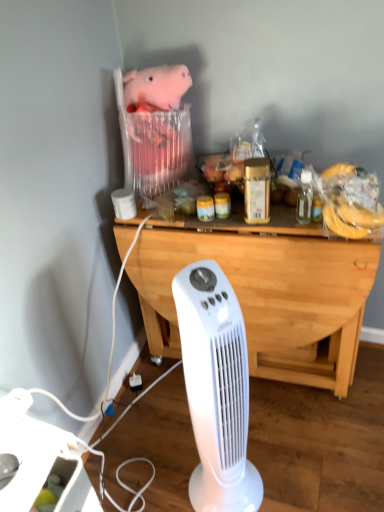
Question: Should I look upward or downward to see white plastic power strip at lower left?

Choices:
 (A) up
 (B) down

Answer: (B)

Question: Is pink plush toy at upper center taller than light wood/dark brown desk at center?

Choices:
 (A) no
 (B) yes

Answer: (A)

Question: Does pink plush toy at upper center have a greater width compared to light wood/dark brown desk at center?

Choices:
 (A) no
 (B) yes

Answer: (A)

Question: From the image's perspective, is pink plush toy at upper center under light wood/dark brown desk at center?

Choices:
 (A) yes
 (B) no

Answer: (B)

Question: Are pink plush toy at upper center and light wood/dark brown desk at center beside each other?

Choices:
 (A) no
 (B) yes

Answer: (A)

Question: Considering the relative sizes of pink plush toy at upper center and light wood/dark brown desk at center in the image provided, is pink plush toy at upper center smaller than light wood/dark brown desk at center?

Choices:
 (A) no
 (B) yes

Answer: (B)

Question: From the image's perspective, is pink plush toy at upper center over light wood/dark brown desk at center?

Choices:
 (A) yes
 (B) no

Answer: (A)

Question: From a real-world perspective, does white plastic power strip at lower left sit lower than light wood/dark brown desk at center?

Choices:
 (A) no
 (B) yes

Answer: (A)

Question: Does white plastic power strip at lower left come behind light wood/dark brown desk at center?

Choices:
 (A) yes
 (B) no

Answer: (B)

Question: Is white plastic power strip at lower left thinner than light wood/dark brown desk at center?

Choices:
 (A) no
 (B) yes

Answer: (B)

Question: Can you confirm if white plastic power strip at lower left is bigger than light wood/dark brown desk at center?

Choices:
 (A) yes
 (B) no

Answer: (B)

Question: Is white plastic power strip at lower left shorter than light wood/dark brown desk at center?

Choices:
 (A) no
 (B) yes

Answer: (B)

Question: Can you confirm if white plastic power strip at lower left is positioned to the left of light wood/dark brown desk at center?

Choices:
 (A) yes
 (B) no

Answer: (A)

Question: Does light wood/dark brown desk at center appear on the right side of white plastic power strip at lower left?

Choices:
 (A) no
 (B) yes

Answer: (B)